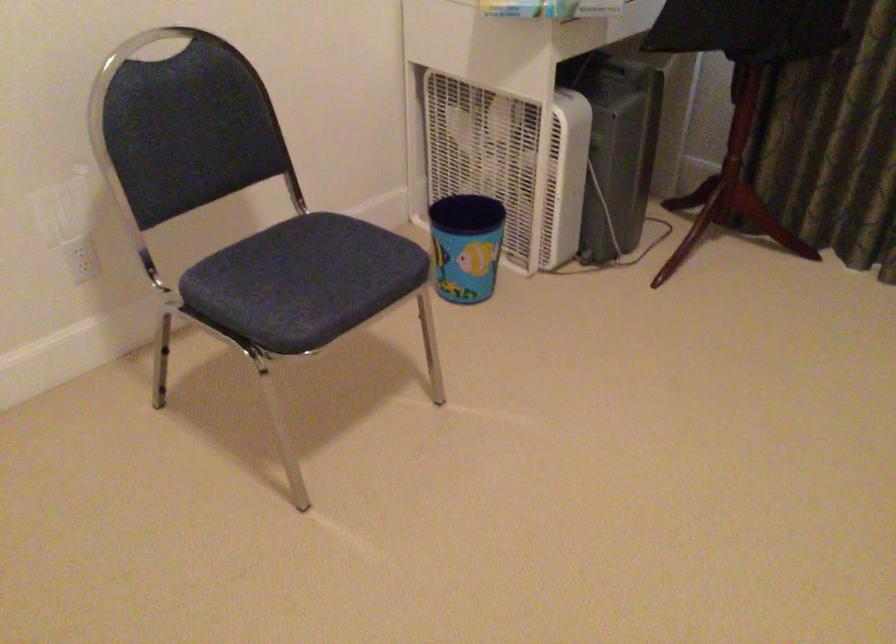
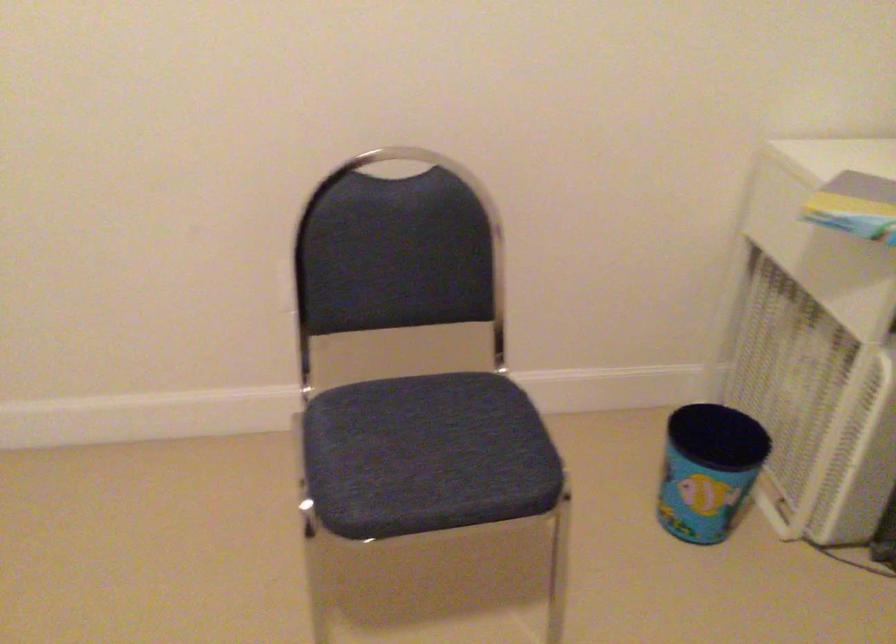
Find the pixel in the second image that matches point (309, 276) in the first image.

(426, 455)